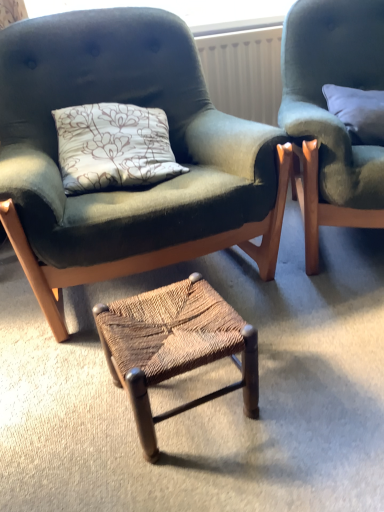
The image size is (384, 512). Describe the element at coordinates (244, 72) in the screenshot. I see `white textured radiator at upper center` at that location.

What is the approximate height of white textured radiator at upper center?

The height of white textured radiator at upper center is 17.55 inches.

The height and width of the screenshot is (512, 384). What do you see at coordinates (331, 114) in the screenshot?
I see `velvet green chair at upper right, which is the first chair in right-to-left order` at bounding box center [331, 114].

Where is `white soft pillow at upper right`? The width and height of the screenshot is (384, 512). white soft pillow at upper right is located at coordinates (358, 112).

Could you tell me if velvet green chair at upper right, which ranks as the second chair in left-to-right order, is turned towards velvet green armchair at center, which is the 2th chair in right-to-left order?

No, velvet green chair at upper right, which ranks as the second chair in left-to-right order, is not oriented towards velvet green armchair at center, which is the 2th chair in right-to-left order.

Is velvet green chair at upper right, which ranks as the second chair in left-to-right order, surrounding velvet green armchair at center, acting as the first chair starting from the left?

No, velvet green armchair at center, acting as the first chair starting from the left, is not surrounded by velvet green chair at upper right, which ranks as the second chair in left-to-right order.

Does velvet green chair at upper right, which ranks as the second chair in left-to-right order, have a lesser width compared to velvet green armchair at center, acting as the first chair starting from the left?

Incorrect, the width of velvet green chair at upper right, which ranks as the second chair in left-to-right order, is not less than that of velvet green armchair at center, acting as the first chair starting from the left.

From the image's perspective, between woven wood stool at center and velvet green chair at upper right, which ranks as the second chair in left-to-right order, who is located below?

From the image's view, woven wood stool at center is below.

How distant is woven wood stool at center from velvet green chair at upper right, which ranks as the second chair in left-to-right order?

woven wood stool at center and velvet green chair at upper right, which ranks as the second chair in left-to-right order, are 24.08 inches apart.

Is woven wood stool at center far from velvet green chair at upper right, which ranks as the second chair in left-to-right order?

No, woven wood stool at center is not far from velvet green chair at upper right, which ranks as the second chair in left-to-right order.

Does woven wood stool at center have a greater height compared to velvet green chair at upper right, which ranks as the second chair in left-to-right order?

A: No.

Who is bigger, woven wood stool at center or white soft pillow at upper right?

woven wood stool at center.

From the image's perspective, would you say woven wood stool at center is shown under white soft pillow at upper right?

Correct, woven wood stool at center appears lower than white soft pillow at upper right in the image.

Considering the relative positions of woven wood stool at center and white soft pillow at upper right in the image provided, is woven wood stool at center to the left or to the right of white soft pillow at upper right?

Based on their positions, woven wood stool at center is located to the left of white soft pillow at upper right.

Between woven wood stool at center and white soft pillow at upper right, which one has more height?

woven wood stool at center is taller.

From the image's perspective, is white soft pillow at upper right located beneath velvet green chair at upper right, which is the first chair in right-to-left order?

Incorrect, from the image's perspective, white soft pillow at upper right is higher than velvet green chair at upper right, which is the first chair in right-to-left order.

Is white soft pillow at upper right to the left of velvet green chair at upper right, which is the first chair in right-to-left order, from the viewer's perspective?

No, white soft pillow at upper right is not to the left of velvet green chair at upper right, which is the first chair in right-to-left order.

Which is behind, point (381, 92) or point (343, 205)?

The point (381, 92) is behind.

Does velvet green armchair at center, which is the 2th chair in right-to-left order, come behind white textured radiator at upper center?

No, velvet green armchair at center, which is the 2th chair in right-to-left order, is closer to the camera.

In the scene shown: Is velvet green armchair at center, acting as the first chair starting from the left, at the right side of white textured radiator at upper center?

Incorrect, velvet green armchair at center, acting as the first chair starting from the left, is not on the right side of white textured radiator at upper center.

Between velvet green armchair at center, acting as the first chair starting from the left, and white textured radiator at upper center, which one has more height?

velvet green armchair at center, acting as the first chair starting from the left.

From a real-world perspective, which object stands above the other?

white textured radiator at upper center.

Between white textured radiator at upper center and white soft pillow at upper right, which one has smaller size?

With smaller size is white textured radiator at upper center.

Is white textured radiator at upper center not inside white soft pillow at upper right?

Absolutely, white textured radiator at upper center is external to white soft pillow at upper right.

From the image's perspective, does velvet green armchair at center, acting as the first chair starting from the left, appear higher than velvet green chair at upper right, which ranks as the second chair in left-to-right order?

No, from the image's perspective, velvet green armchair at center, acting as the first chair starting from the left, is not over velvet green chair at upper right, which ranks as the second chair in left-to-right order.

Measure the distance between velvet green armchair at center, acting as the first chair starting from the left, and velvet green chair at upper right, which is the first chair in right-to-left order.

17.79 inches.

Which object is positioned more to the left, velvet green armchair at center, acting as the first chair starting from the left, or velvet green chair at upper right, which is the first chair in right-to-left order?

velvet green armchair at center, acting as the first chair starting from the left, is more to the left.

Between velvet green armchair at center, acting as the first chair starting from the left, and velvet green chair at upper right, which ranks as the second chair in left-to-right order, which one is positioned behind?

velvet green chair at upper right, which ranks as the second chair in left-to-right order, is further from the camera.

Locate an element on the screen. This screenshot has height=512, width=384. chair behind the velvet green armchair at center, acting as the first chair starting from the left is located at coordinates (331, 114).

In the image, there is a velvet green chair at upper right, which is the first chair in right-to-left order. What are the coordinates of `stool below it (from a real-world perspective)` in the screenshot? It's located at (175, 347).

From the image, which object appears to be nearer to woven wood stool at center, white soft pillow at upper right or velvet green chair at upper right, which is the first chair in right-to-left order?

velvet green chair at upper right, which is the first chair in right-to-left order, lies closer to woven wood stool at center than the other object.

Looking at this image, from the image, which object appears to be nearer to white textured radiator at upper center, velvet green chair at upper right, which is the first chair in right-to-left order, or velvet green armchair at center, acting as the first chair starting from the left?

The object closer to white textured radiator at upper center is velvet green armchair at center, acting as the first chair starting from the left.

Looking at the image, which one is located further to velvet green armchair at center, which is the 2th chair in right-to-left order, woven wood stool at center or velvet green chair at upper right, which is the first chair in right-to-left order?

velvet green chair at upper right, which is the first chair in right-to-left order, is further to velvet green armchair at center, which is the 2th chair in right-to-left order.

Looking at this image, which object lies further to the anchor point white soft pillow at upper right, woven wood stool at center or velvet green armchair at center, which is the 2th chair in right-to-left order?

Among the two, woven wood stool at center is located further to white soft pillow at upper right.

Considering their positions, is white soft pillow at upper right positioned further to woven wood stool at center than white textured radiator at upper center?

white textured radiator at upper center is further to woven wood stool at center.

Based on their spatial positions, is velvet green armchair at center, acting as the first chair starting from the left, or woven wood stool at center further from velvet green chair at upper right, which is the first chair in right-to-left order?

woven wood stool at center lies further to velvet green chair at upper right, which is the first chair in right-to-left order, than the other object.

When comparing their distances from velvet green armchair at center, which is the 2th chair in right-to-left order, does white textured radiator at upper center or woven wood stool at center seem closer?

woven wood stool at center is closer to velvet green armchair at center, which is the 2th chair in right-to-left order.

Based on their spatial positions, is velvet green armchair at center, acting as the first chair starting from the left, or velvet green chair at upper right, which is the first chair in right-to-left order, further from white soft pillow at upper right?

Based on the image, velvet green armchair at center, acting as the first chair starting from the left, appears to be further to white soft pillow at upper right.

You are a GUI agent. You are given a task and a screenshot of the screen. Output one action in this format:
    pyautogui.click(x=<x>, y=<y>)
    Task: Click on the stool located between velvet green armchair at center, which is the 2th chair in right-to-left order, and white textured radiator at upper center in the depth direction
    
    Given the screenshot: What is the action you would take?
    pyautogui.click(x=175, y=347)

Where is `chair positioned between woven wood stool at center and white textured radiator at upper center from near to far`? chair positioned between woven wood stool at center and white textured radiator at upper center from near to far is located at coordinates (331, 114).

The image size is (384, 512). I want to click on pillow between white textured radiator at upper center and woven wood stool at center in the vertical direction, so click(358, 112).

I want to click on chair located between velvet green armchair at center, which is the 2th chair in right-to-left order, and white soft pillow at upper right in the left-right direction, so click(331, 114).